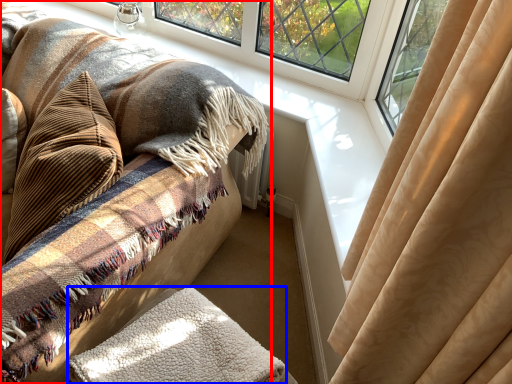
Question: Among these objects, which one is farthest to the camera, furniture (highlighted by a red box) or blanket (highlighted by a blue box)?

Choices:
 (A) furniture
 (B) blanket

Answer: (B)